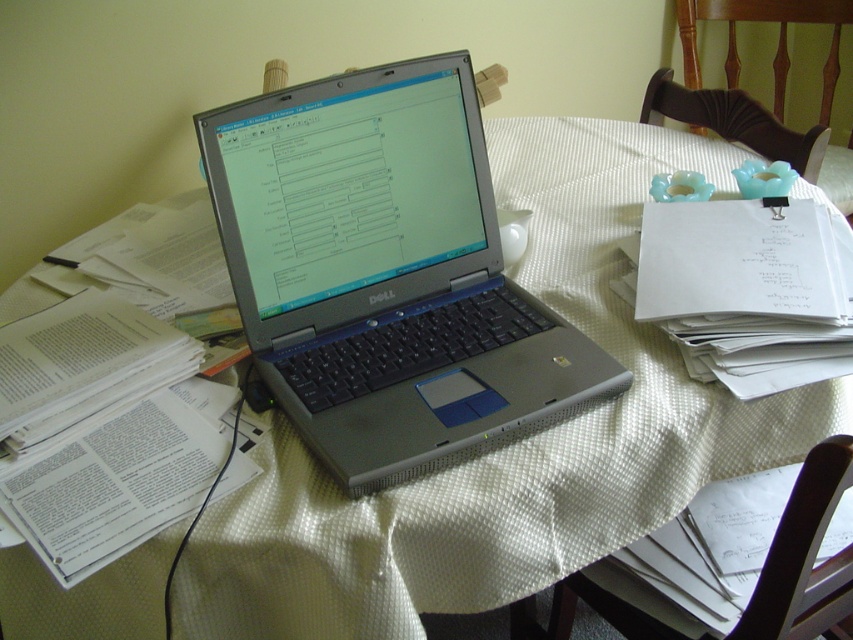
You are organizing a workspace and need to place a new item at coordinates point1. The silver metallic laptop at center is currently at point2. Can you place the new item at point1 without moving the laptop?

The silver metallic laptop at center is located at point2, so placing the new item at point1 would require moving the laptop unless point1 and point2 are the same location.

You have a small box that is exactly the same size as the white paper at upper right. You want to place this box on the table so it doesn not overlap with the silver metallic laptop at center. Is this possible given their sizes?

The silver metallic laptop at center is wider than the white paper at upper right. Since the box is the same size as the white paper, it can be placed on the table without overlapping the laptop as long as there is enough space around the laptop.